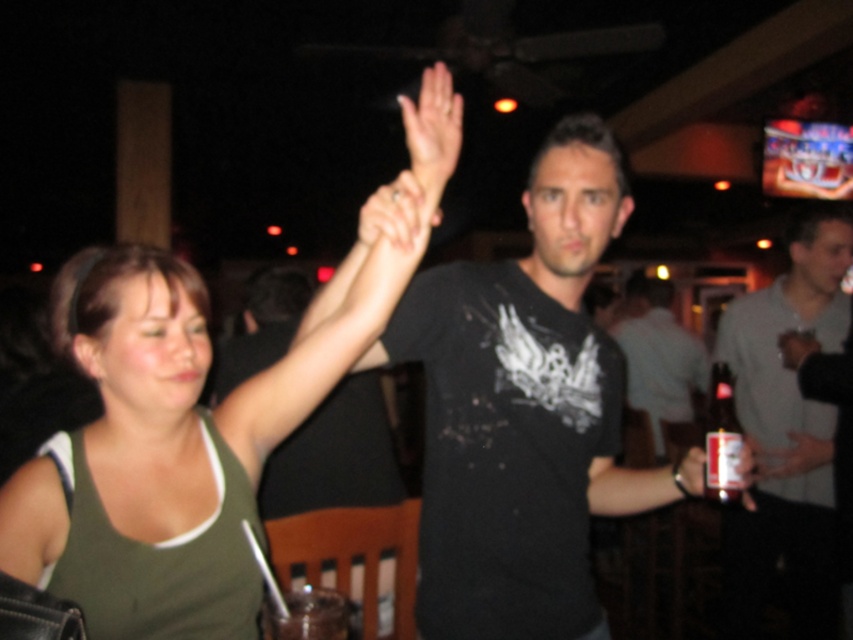
Can you confirm if gray cotton shirt at right is smaller than translucent glass cup at lower center?

No, gray cotton shirt at right is not smaller than translucent glass cup at lower center.

Does point (845, 260) lie behind point (320, 630)?

That is True.

I want to click on gray cotton shirt at right, so click(x=786, y=432).

Is point (314, 362) less distant than point (285, 598)?

That is False.

Is point (312, 376) behind point (274, 616)?

Yes.

What do you see at coordinates (149, 412) in the screenshot? This screenshot has height=640, width=853. I see `green fabric tank top at upper left` at bounding box center [149, 412].

Where is `green fabric tank top at upper left`? The height and width of the screenshot is (640, 853). green fabric tank top at upper left is located at coordinates (149, 412).

Which is below, green fabric tank top at upper left or gray cotton shirt at right?

Positioned lower is gray cotton shirt at right.

Is green fabric tank top at upper left shorter than gray cotton shirt at right?

Yes, green fabric tank top at upper left is shorter than gray cotton shirt at right.

Is point (47, 484) in front of point (741, 296)?

That is True.

Where is `green fabric tank top at upper left`? The image size is (853, 640). green fabric tank top at upper left is located at coordinates (149, 412).